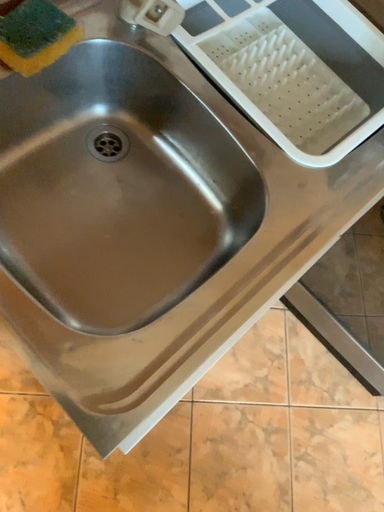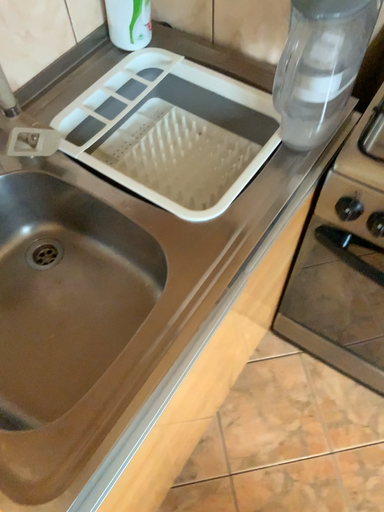
Question: Which way did the camera rotate in the video?

Choices:
 (A) rotated downward
 (B) rotated upward

Answer: (B)